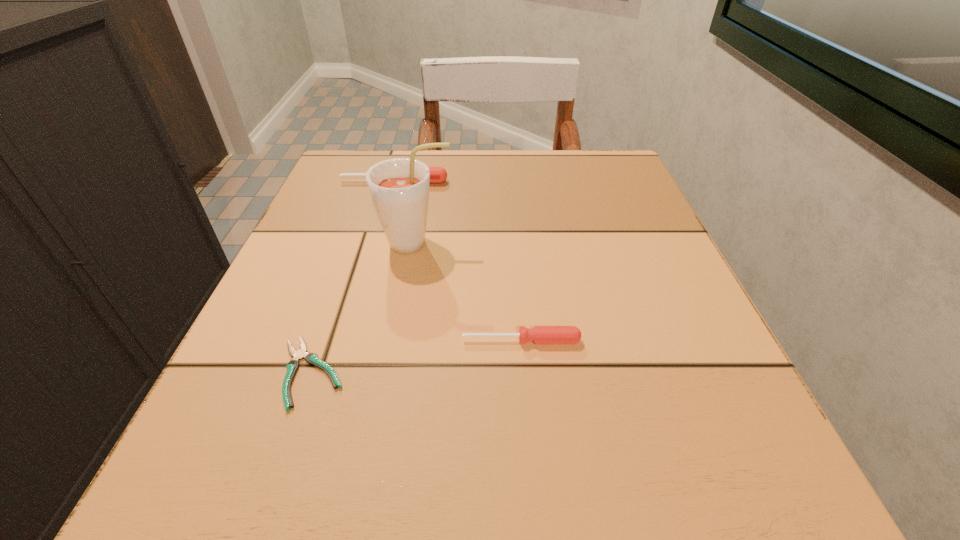
Find the location of `blank space located on the back of the pliers`. blank space located on the back of the pliers is located at coordinates (367, 209).

You are a GUI agent. You are given a task and a screenshot of the screen. Output one action in this format:
    pyautogui.click(x=<x>, y=<y>)
    Task: Click on the object at the far edge
    Image resolution: width=960 pixels, height=540 pixels.
    Given the screenshot: What is the action you would take?
    pyautogui.click(x=437, y=174)

Find the location of a particular element. Image resolution: width=960 pixels, height=540 pixels. root beer that is at the left edge is located at coordinates (399, 187).

What are the coordinates of `screwdriver that is at the left edge` in the screenshot? It's located at (437, 174).

This screenshot has width=960, height=540. I want to click on pliers that is at the left edge, so click(x=311, y=358).

This screenshot has width=960, height=540. Identify the location of object that is at the far left corner. (437, 174).

Find the location of a particular element. free space at the far edge of the desktop is located at coordinates (486, 174).

The height and width of the screenshot is (540, 960). I want to click on blank space at the near edge of the desktop, so (464, 476).

Where is `free region at the left edge of the desktop`? The width and height of the screenshot is (960, 540). free region at the left edge of the desktop is located at coordinates (331, 285).

This screenshot has width=960, height=540. I want to click on free point at the right edge, so click(x=630, y=294).